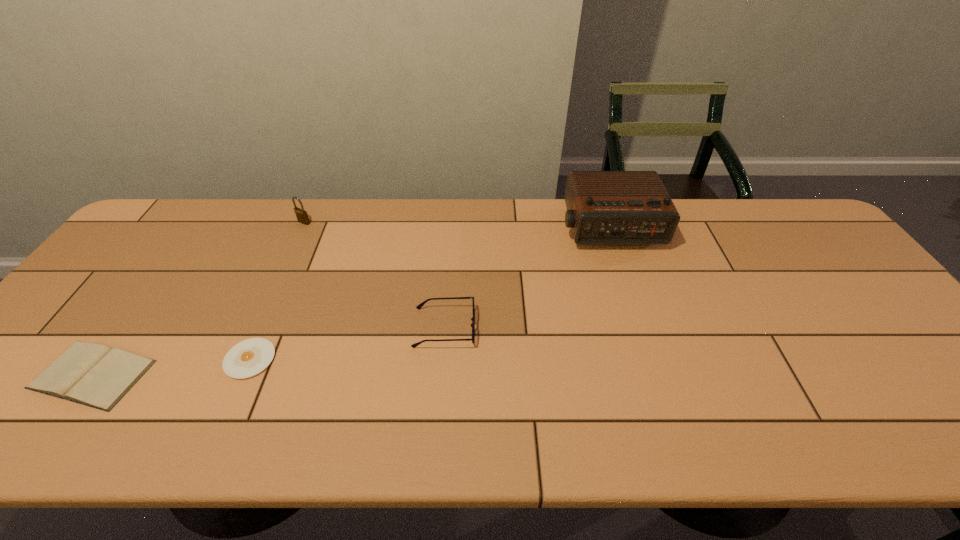
The width and height of the screenshot is (960, 540). What are the coordinates of `the rightmost object` in the screenshot? It's located at (603, 207).

Locate an element on the screen. The height and width of the screenshot is (540, 960). radio receiver is located at coordinates (603, 207).

Locate an element on the screen. The height and width of the screenshot is (540, 960). the second tallest object is located at coordinates (302, 216).

Where is `spectacles`? spectacles is located at coordinates (419, 306).

Identify the location of the fourth object from left to right. Image resolution: width=960 pixels, height=540 pixels. (419, 306).

Where is `the second shortest object`? The height and width of the screenshot is (540, 960). the second shortest object is located at coordinates (95, 375).

At what (x,y) coordinates should I click in order to perform the action: click on Bible. Please return your answer as a coordinate pair (x, y). This screenshot has height=540, width=960. Looking at the image, I should click on (95, 375).

Locate an element on the screen. This screenshot has width=960, height=540. egg yolk is located at coordinates (249, 357).

This screenshot has width=960, height=540. In order to click on free location located 0.230m on the tuning display of the radio receiver in this screenshot , I will do `click(636, 312)`.

You are a GUI agent. You are given a task and a screenshot of the screen. Output one action in this format:
    pyautogui.click(x=<x>, y=<y>)
    Task: Click on the vacant space located 0.350m on the right of the second tallest object
    
    Given the screenshot: What is the action you would take?
    pyautogui.click(x=421, y=222)